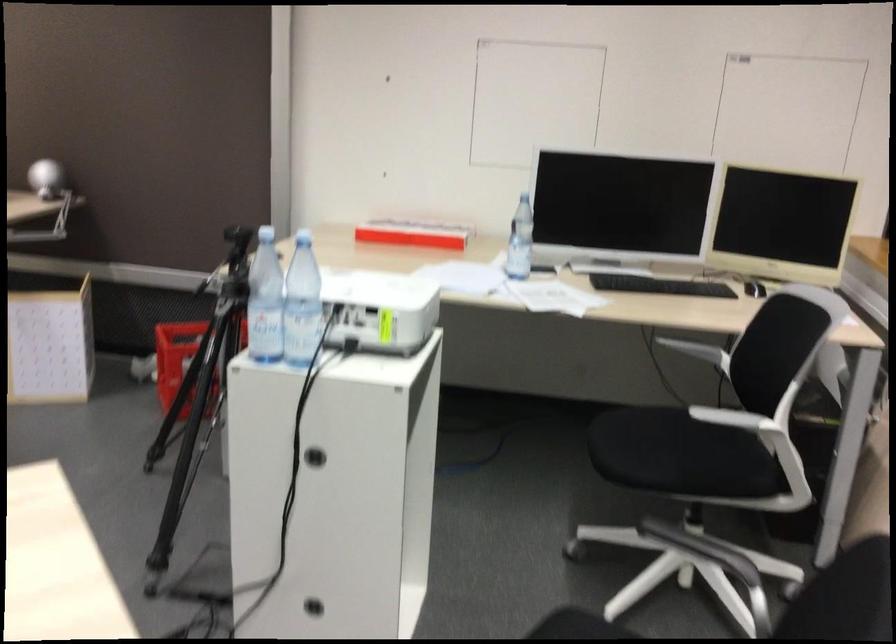
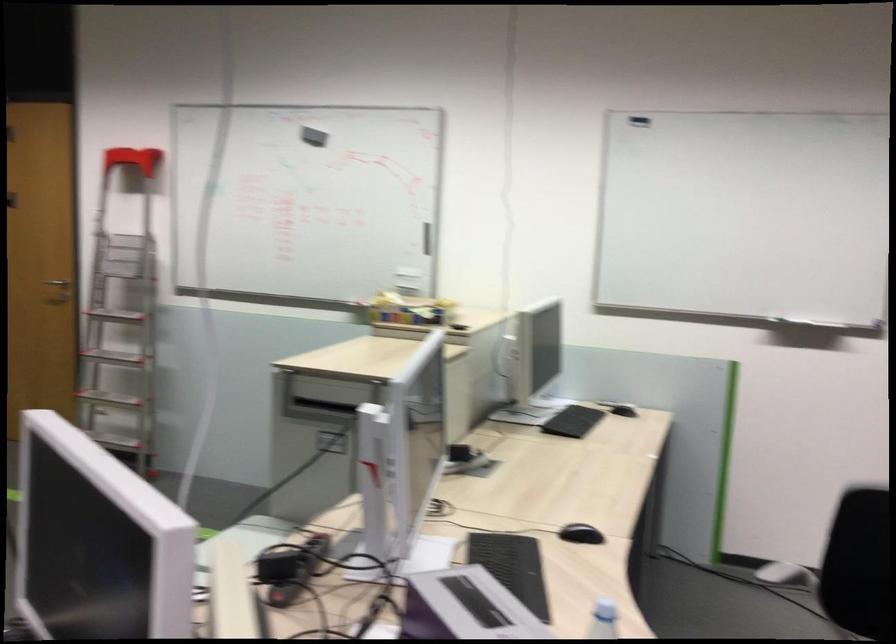
Question: Based on the continuous images, in which direction is the camera rotating? Reply with the corresponding letter.

Choices:
 (A) Left
 (B) Right
 (C) Up
 (D) Down

Answer: (A)